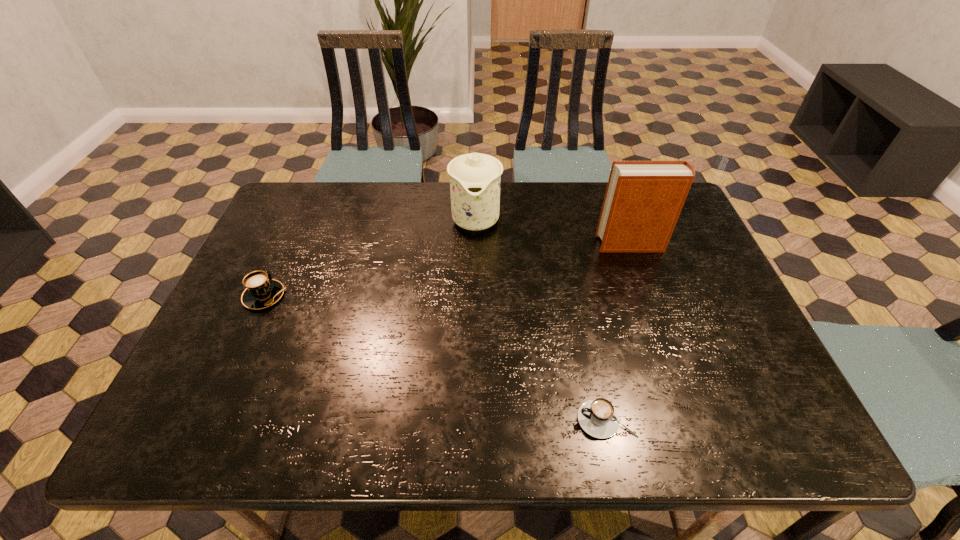
Identify the location of free space between the hardback book and the second nearest object. The image size is (960, 540). (447, 270).

You are a GUI agent. You are given a task and a screenshot of the screen. Output one action in this format:
    pyautogui.click(x=<x>, y=<y>)
    Task: Click on the free space between the second object from left to right and the farther cappuccino
    The height and width of the screenshot is (540, 960).
    Given the screenshot: What is the action you would take?
    pyautogui.click(x=370, y=257)

Locate an element on the screen. This screenshot has height=540, width=960. vacant area that lies between the taller cappuccino and the second object from left to right is located at coordinates (370, 257).

The image size is (960, 540). Find the location of `object that stands as the second closest to the chinaware`. object that stands as the second closest to the chinaware is located at coordinates (261, 292).

Select which object is the second closest to the rightmost object. Please provide its 2D coordinates. Your answer should be formatted as a tuple, i.e. [(x, y)], where the tuple contains the x and y coordinates of a point satisfying the conditions above.

[(598, 418)]